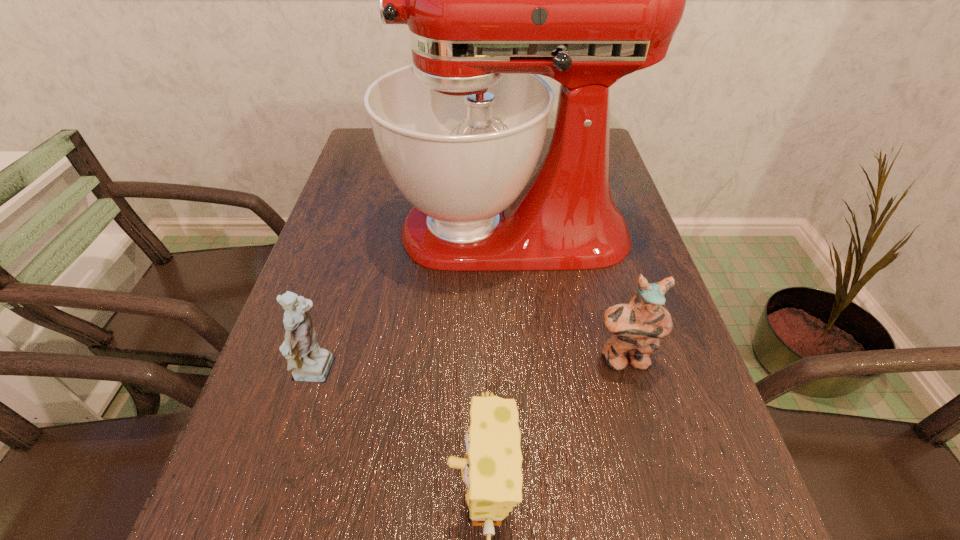
This screenshot has height=540, width=960. Identify the location of the farthest object. (492, 0).

Where is `mixer`? mixer is located at coordinates (492, 0).

This screenshot has width=960, height=540. Identify the location of the leftmost object. (310, 363).

You are a GUI agent. You are given a task and a screenshot of the screen. Output one action in this format:
    pyautogui.click(x=<x>, y=<y>)
    Task: Click on the right figurine
    The width and height of the screenshot is (960, 540).
    Given the screenshot: What is the action you would take?
    pyautogui.click(x=637, y=327)

The width and height of the screenshot is (960, 540). Find the location of `free point located at the attachment hub of the tallest object`. free point located at the attachment hub of the tallest object is located at coordinates (333, 231).

I want to click on vacant space located 0.060m at the attachment hub of the tallest object, so click(x=366, y=231).

What are the coordinates of `vacant space located at the attachment hub of the tallest object` in the screenshot? It's located at (324, 231).

Locate an element on the screen. vacant region located on the front-facing side of the left figurine is located at coordinates (465, 374).

Locate an element on the screen. This screenshot has width=960, height=540. blank area located 0.110m on the front-facing side of the right figurine is located at coordinates coord(643,433).

This screenshot has height=540, width=960. I want to click on mixer that is at the left edge, so click(492, 0).